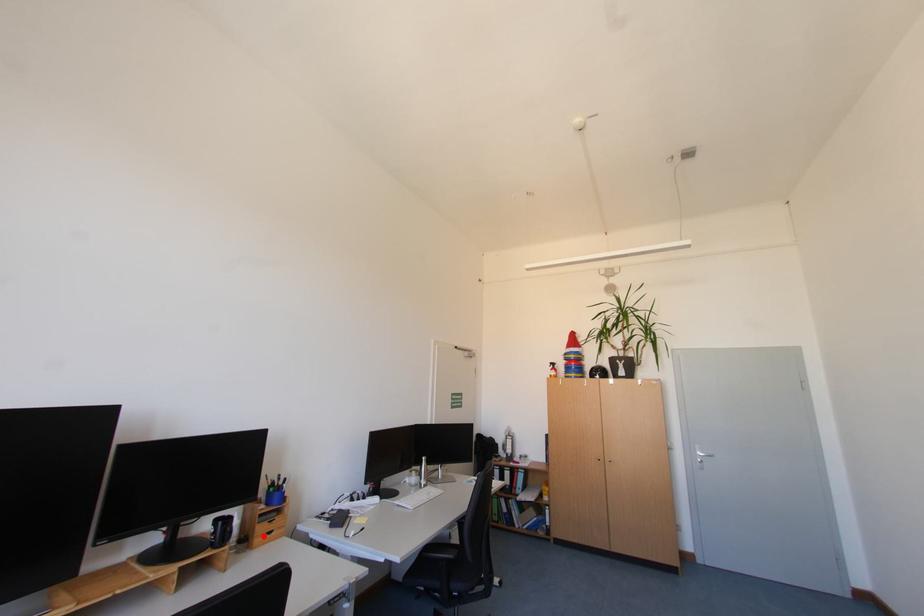
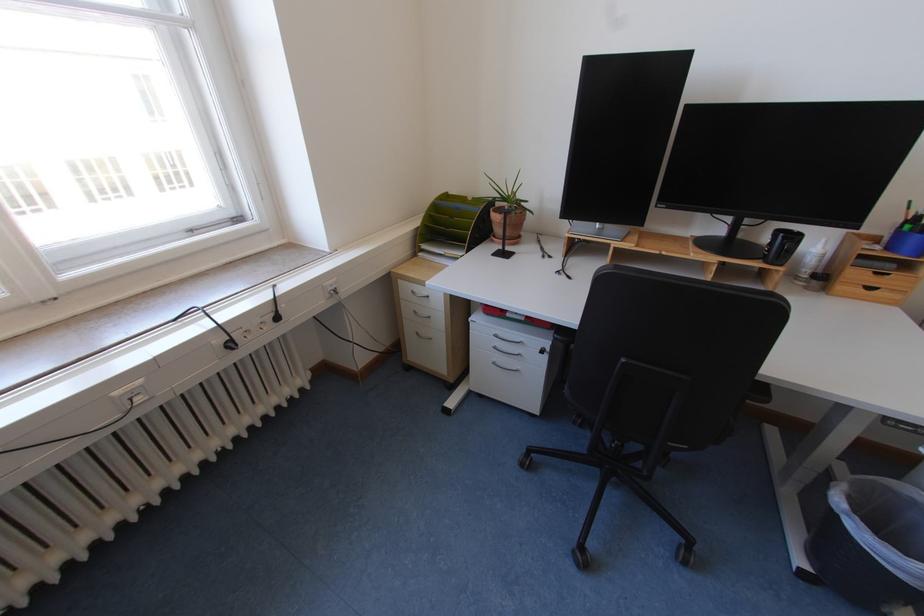
The point at the highlighted location is marked in the first image. Where is the corresponding point in the second image?

(848, 281)